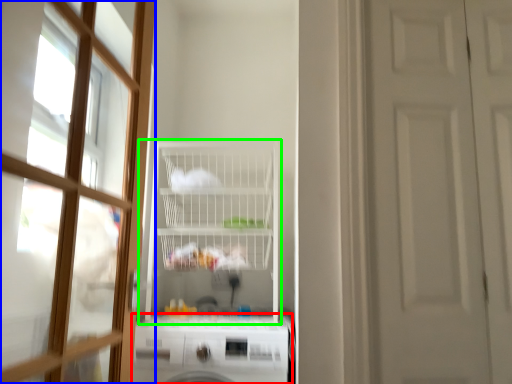
Question: Which object is positioned farthest from dish washer (highlighted by a red box)? Select from door (highlighted by a blue box) and shelf (highlighted by a green box).

Choices:
 (A) door
 (B) shelf

Answer: (A)